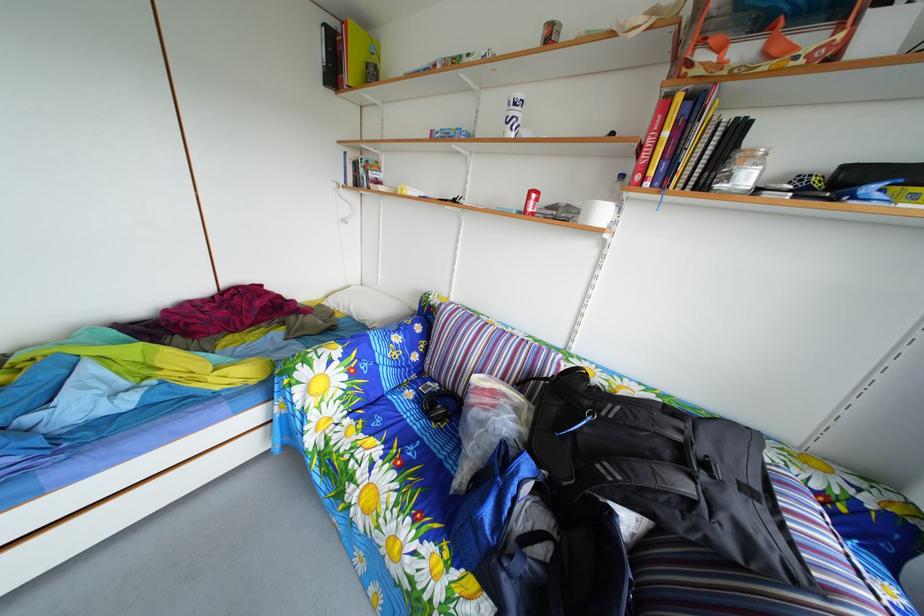
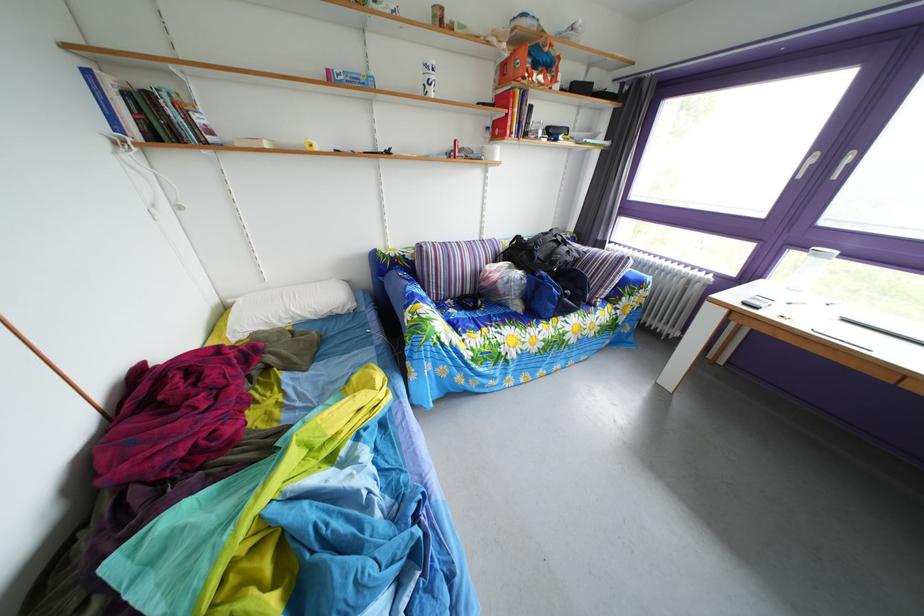
The point at (360, 313) is marked in the first image. Where is the corresponding point in the second image?

(298, 320)